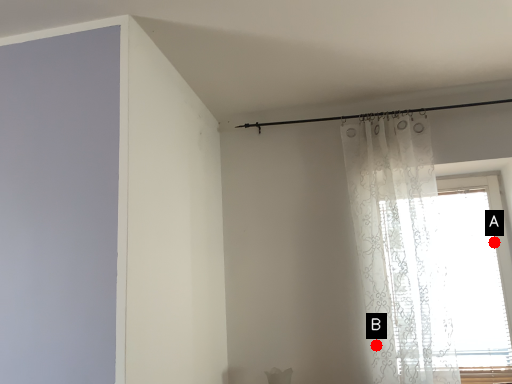
Question: Two points are circled on the image, labeled by A and B beside each circle. Which point is further to the camera?

Choices:
 (A) A is further
 (B) B is further

Answer: (A)